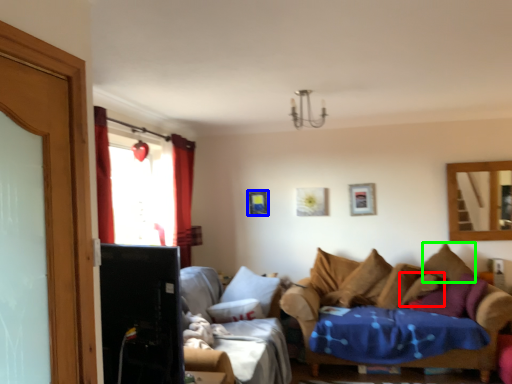
Question: Which object is positioned closest to pillow (highlighted by a red box)? Select from picture frame (highlighted by a blue box) and pillow (highlighted by a green box).

Choices:
 (A) picture frame
 (B) pillow

Answer: (B)